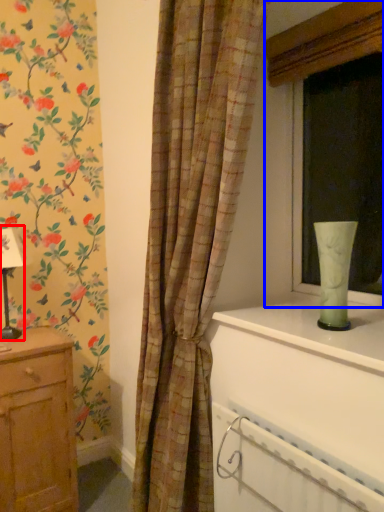
Question: Among these objects, which one is farthest to the camera, table lamp (highlighted by a red box) or window (highlighted by a blue box)?

Choices:
 (A) table lamp
 (B) window

Answer: (A)